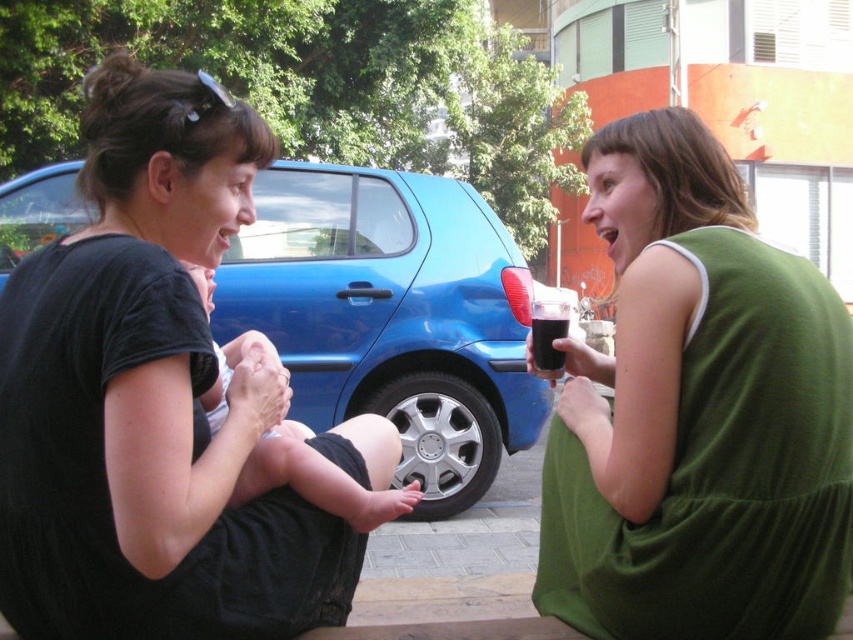
Question: Which point appears closest to the camera in this image?

Choices:
 (A) (660, 420)
 (B) (451, 394)

Answer: (A)

Question: Which of these objects is positioned closest to the blue metallic car at center?

Choices:
 (A) green fabric dress at center
 (B) soft skin baby at center

Answer: (B)

Question: Is blue metallic car at center to the right of soft skin baby at center from the viewer's perspective?

Choices:
 (A) yes
 (B) no

Answer: (A)

Question: Where is green fabric dress at center located in relation to blue metallic car at center in the image?

Choices:
 (A) left
 (B) right

Answer: (B)

Question: Estimate the real-world distances between objects in this image. Which object is closer to the green fabric dress at center?

Choices:
 (A) soft skin baby at center
 (B) blue metallic car at center

Answer: (A)

Question: Is green fabric dress at center above blue metallic car at center?

Choices:
 (A) yes
 (B) no

Answer: (B)